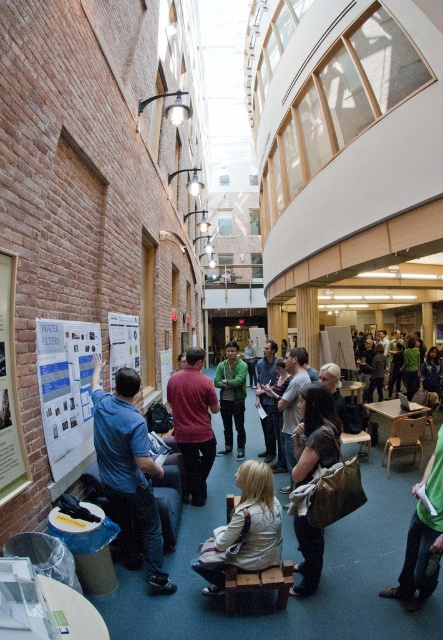
Between blue paper poster at left and white paper at left, which one appears on the right side from the viewer's perspective?

blue paper poster at left

Does blue paper poster at left come behind white paper at left?

That is False.

Who is more forward, (58,480) or (113,356)?

Positioned in front is point (58,480).

Find the location of a particular element. The width and height of the screenshot is (443, 640). blue paper poster at left is located at coordinates (66, 388).

Is white leather jacket at center taller than matte red shirt at center?

In fact, white leather jacket at center may be shorter than matte red shirt at center.

The image size is (443, 640). What do you see at coordinates (244, 531) in the screenshot?
I see `white leather jacket at center` at bounding box center [244, 531].

This screenshot has height=640, width=443. I want to click on white leather jacket at center, so click(x=244, y=531).

From the picture: How much distance is there between blue denim jeans at left and blue paper poster at left?

blue denim jeans at left and blue paper poster at left are 12.99 inches apart from each other.

Does point (143, 524) lie behind point (39, 346)?

Yes, point (143, 524) is behind point (39, 346).

Find the location of a particular element. This screenshot has width=443, height=640. blue denim jeans at left is located at coordinates (128, 472).